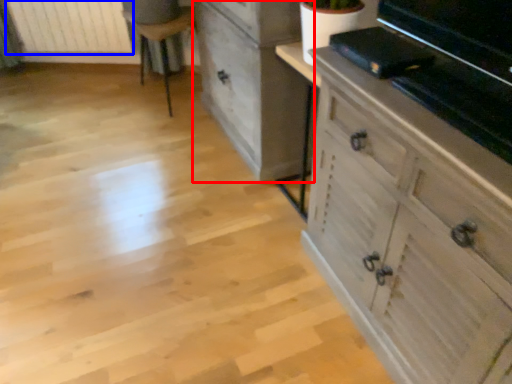
Question: Which object is closer to the camera taking this photo, chest of drawers (highlighted by a red box) or radiator (highlighted by a blue box)?

Choices:
 (A) chest of drawers
 (B) radiator

Answer: (A)